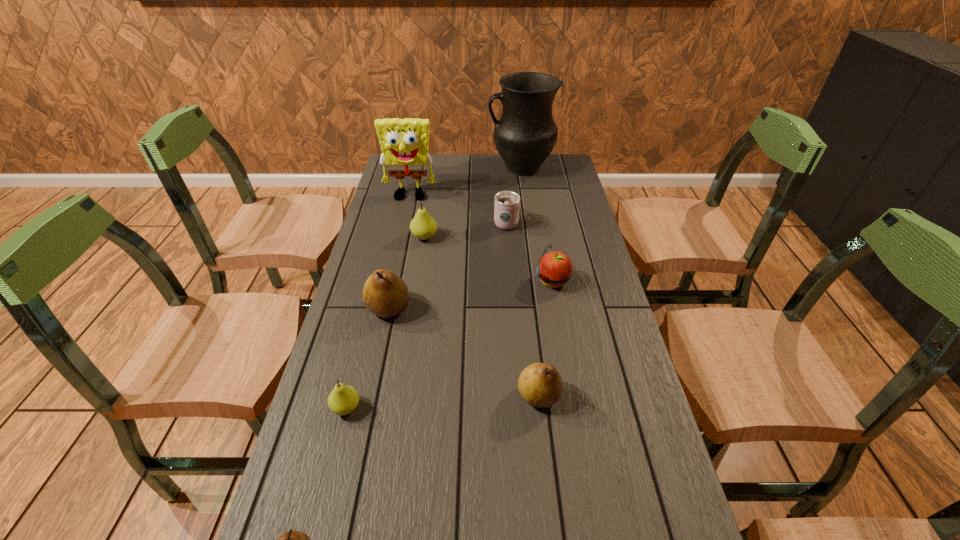
You are a GUI agent. You are given a task and a screenshot of the screen. Output one action in this format:
    pyautogui.click(x=<x>, y=<y>)
    Task: Click on the object that is at the far right corner
    
    Given the screenshot: What is the action you would take?
    pyautogui.click(x=524, y=136)

Locate an element on the screen. vacant space at the far edge of the desktop is located at coordinates (438, 178).

Locate an element on the screen. The height and width of the screenshot is (540, 960). free point at the left edge is located at coordinates (389, 236).

Where is `free space at the right edge of the desktop`? The height and width of the screenshot is (540, 960). free space at the right edge of the desktop is located at coordinates (673, 520).

Where is `vacant space at the far right corner of the desktop`? vacant space at the far right corner of the desktop is located at coordinates (546, 165).

This screenshot has height=540, width=960. I want to click on vacant area that lies between the farthest brown pear and the cup, so click(x=447, y=265).

The image size is (960, 540). I want to click on free space between the second farthest brown pear and the black pitcher, so click(x=530, y=282).

At what (x,y) coordinates should I click in order to perform the action: click on vacant area that lies between the tallest pear and the farther green pear. Please return your answer as a coordinate pair (x, y). The height and width of the screenshot is (540, 960). Looking at the image, I should click on (407, 273).

Identify which object is located as the eighth nearest to the pitcher. Please provide its 2D coordinates. Your answer should be formatted as a tuple, i.e. [(x, y)], where the tuple contains the x and y coordinates of a point satisfying the conditions above.

[(293, 539)]

The width and height of the screenshot is (960, 540). In order to click on the third closest object relative to the apple in this screenshot , I will do `click(422, 226)`.